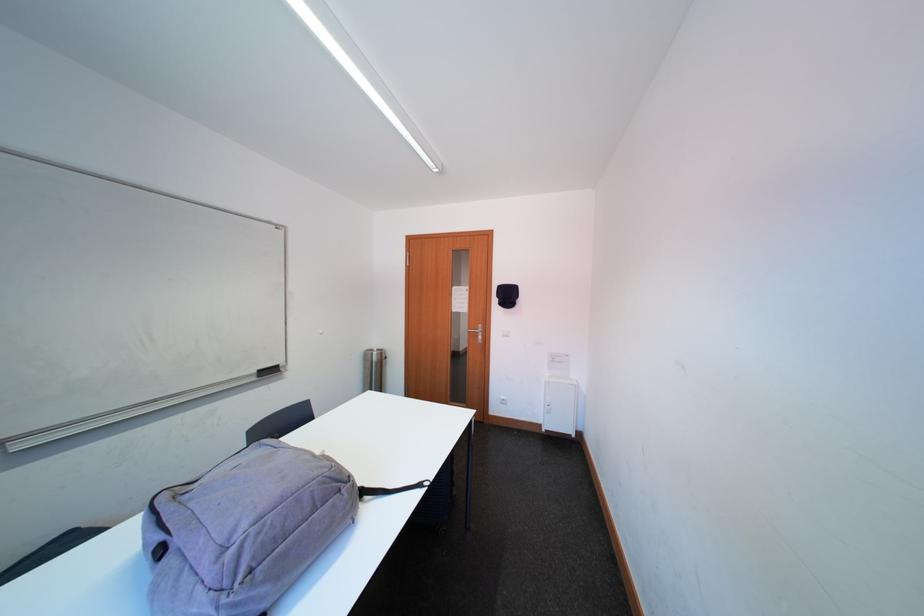
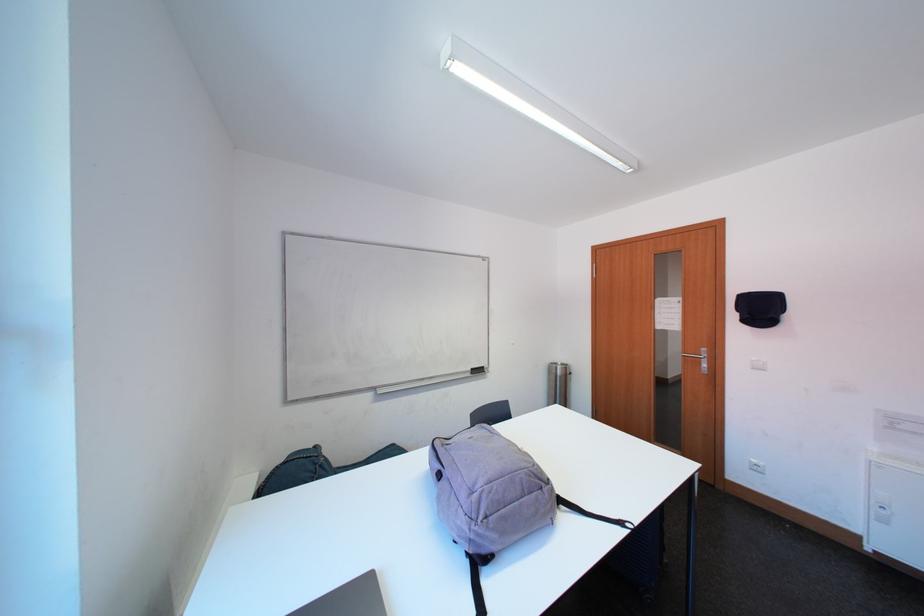
Where in the second image is the point corresponding to (x=517, y=300) from the first image?

(771, 313)